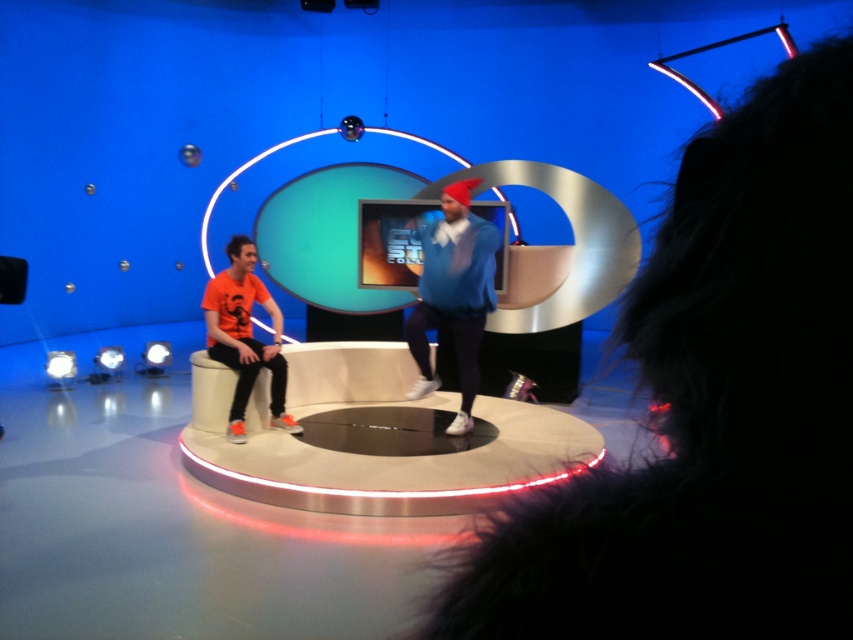
Question: Among these objects, which one is nearest to the camera?

Choices:
 (A) orange matte t-shirt at left
 (B) blue fleece jacket at center

Answer: (B)

Question: Which of the following is the farthest from the observer?

Choices:
 (A) blue fleece jacket at center
 (B) orange matte t-shirt at left

Answer: (B)

Question: Is blue fleece jacket at center bigger than orange matte t-shirt at left?

Choices:
 (A) yes
 (B) no

Answer: (A)

Question: Is blue fleece jacket at center positioned at the back of orange matte t-shirt at left?

Choices:
 (A) yes
 (B) no

Answer: (B)

Question: Does blue fleece jacket at center appear on the left side of orange matte t-shirt at left?

Choices:
 (A) no
 (B) yes

Answer: (A)